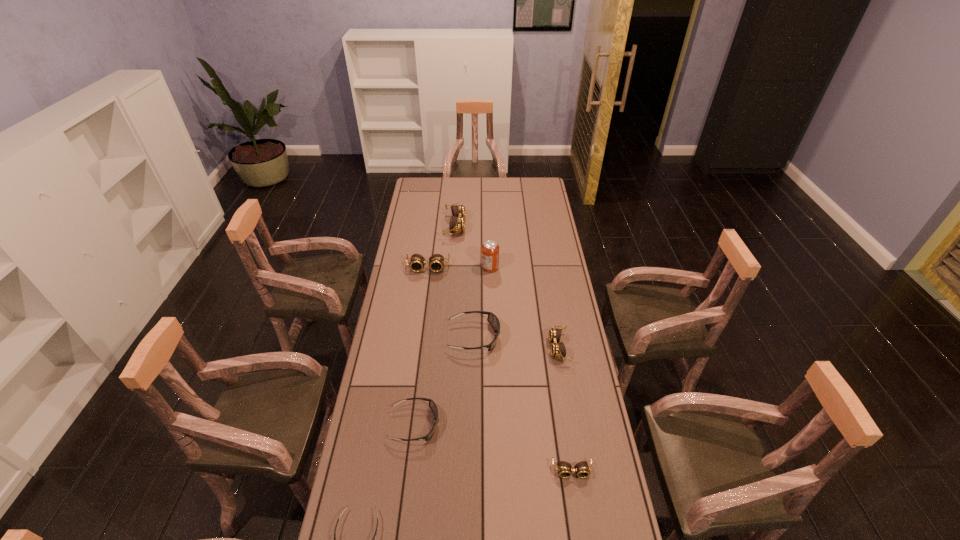
What are the coordinates of `the third nearest object` in the screenshot? It's located at (432, 405).

Where is `the nearest brown goggles`? The height and width of the screenshot is (540, 960). the nearest brown goggles is located at coordinates (564, 470).

You are a GUI agent. You are given a task and a screenshot of the screen. Output one action in this format:
    pyautogui.click(x=<x>, y=<y>)
    Task: Click on the sixth farthest goggles
    The width and height of the screenshot is (960, 540).
    Given the screenshot: What is the action you would take?
    pyautogui.click(x=564, y=470)

Locate an element on the screen. This screenshot has height=540, width=960. vacant space located 0.360m on the back of the orange can is located at coordinates (489, 220).

At what (x,y) coordinates should I click in order to perform the action: click on free space located 0.360m through the lenses of the biggest brown goggles. Please return your answer as a coordinate pair (x, y). The width and height of the screenshot is (960, 540). Looking at the image, I should click on (533, 226).

At what (x,y) coordinates should I click in order to perform the action: click on free location located through the lenses of the second farthest goggles. Please return your answer as a coordinate pair (x, y). Looking at the image, I should click on (424, 295).

Locate an element on the screen. The width and height of the screenshot is (960, 540). vacant space situated on the lenses of the rightmost black goggles is located at coordinates (554, 337).

Locate an element on the screen. vacant region located through the lenses of the second nearest brown goggles is located at coordinates (473, 348).

Locate an element on the screen. The image size is (960, 540). blank space located 0.370m through the lenses of the second nearest brown goggles is located at coordinates (456, 348).

The width and height of the screenshot is (960, 540). I want to click on vacant space located through the lenses of the second nearest brown goggles, so click(x=479, y=348).